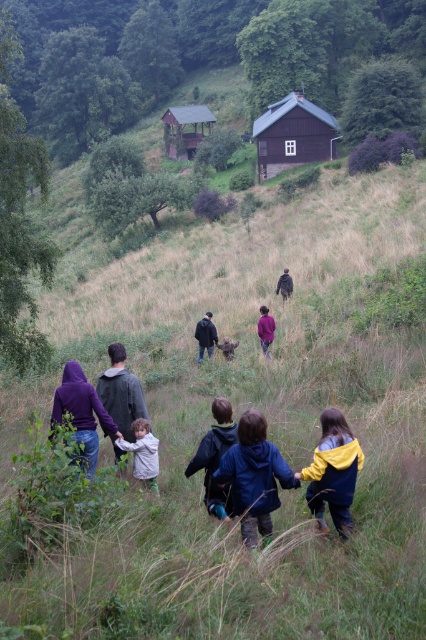
Question: Does dark brown wooden hut at upper center have a lesser width compared to light gray fleece jacket at center?

Choices:
 (A) yes
 (B) no

Answer: (B)

Question: Which point appears closest to the camera in this image?

Choices:
 (A) (104, 429)
 (B) (72, 385)

Answer: (B)

Question: Which object is closer to the camera taking this photo?

Choices:
 (A) yellow and blue jacket at lower right
 (B) blue fabric jacket at center
 (C) blue denim jacket at center

Answer: (B)

Question: Is dark gray jacket at center thinner than purple fleece jacket at center?

Choices:
 (A) no
 (B) yes

Answer: (A)

Question: Which object is positioned closest to the purple fleece jacket at center?

Choices:
 (A) dark gray jacket at center
 (B) light gray fleece jacket at center
 (C) wooden hut at upper center

Answer: (B)

Question: From the image, what is the correct spatial relationship of yellow and blue jacket at lower right in relation to dark gray jacket at center?

Choices:
 (A) left
 (B) right

Answer: (B)